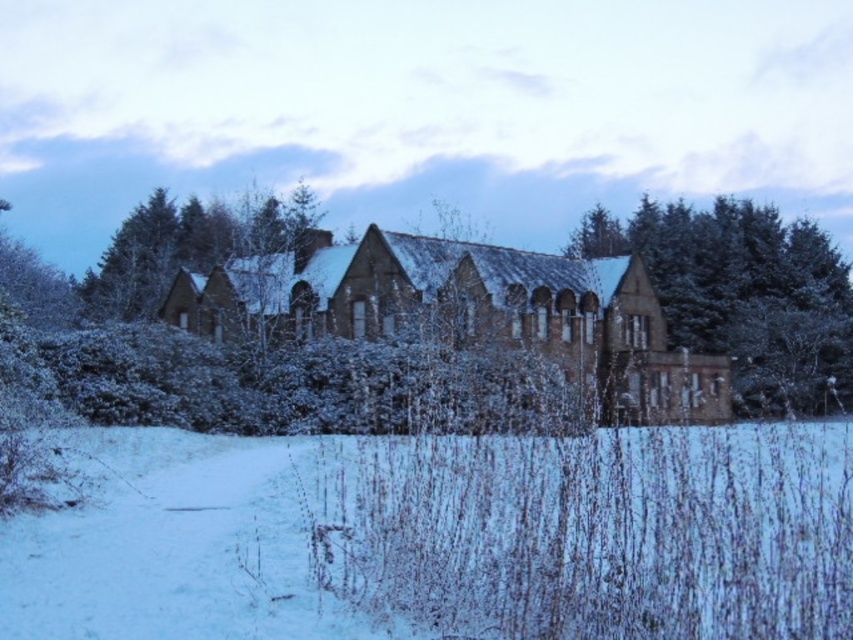
Does white fluffy snow at lower center appear on the right side of green textured tree at center?

Incorrect, white fluffy snow at lower center is not on the right side of green textured tree at center.

Can you confirm if white fluffy snow at lower center is smaller than green textured tree at center?

Correct, white fluffy snow at lower center occupies less space than green textured tree at center.

You are a GUI agent. You are given a task and a screenshot of the screen. Output one action in this format:
    pyautogui.click(x=<x>, y=<y>)
    Task: Click on the white fluffy snow at lower center
    The height and width of the screenshot is (640, 853).
    Given the screenshot: What is the action you would take?
    pyautogui.click(x=448, y=538)

Between point (469, 532) and point (486, 253), which one is positioned behind?

The point (486, 253) is behind.

At what (x,y) coordinates should I click in order to perform the action: click on white fluffy snow at lower center. Please return your answer as a coordinate pair (x, y). The height and width of the screenshot is (640, 853). Looking at the image, I should click on [448, 538].

Does brown stone church at center appear under green textured tree at center?

Indeed, brown stone church at center is positioned under green textured tree at center.

Does brown stone church at center have a lesser width compared to green textured tree at center?

Incorrect, brown stone church at center's width is not less than green textured tree at center's.

What do you see at coordinates (467, 312) in the screenshot? Image resolution: width=853 pixels, height=640 pixels. I see `brown stone church at center` at bounding box center [467, 312].

In order to click on brown stone church at center in this screenshot , I will do `click(467, 312)`.